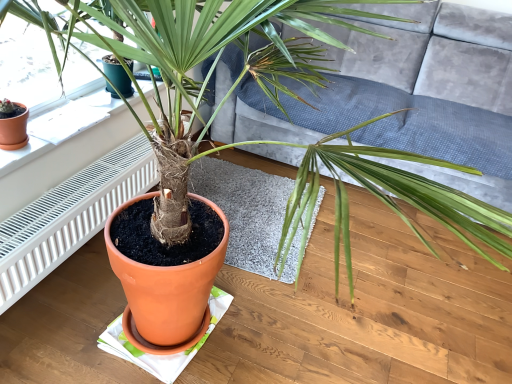
The height and width of the screenshot is (384, 512). In order to click on free space in front of gray soft rug at center in this screenshot , I will do [230, 329].